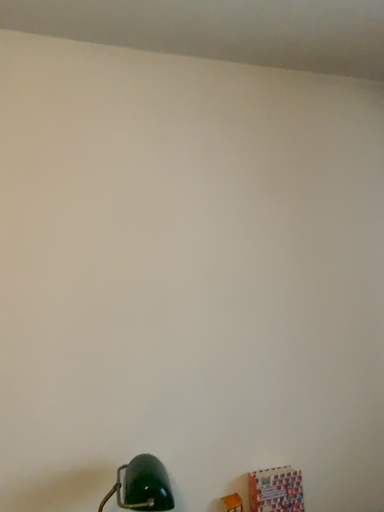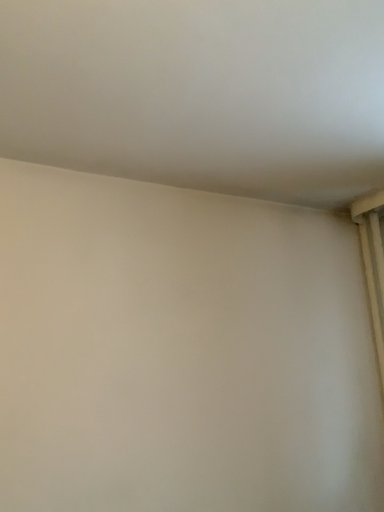
Question: Which way did the camera rotate in the video?

Choices:
 (A) rotated upward
 (B) rotated downward

Answer: (A)